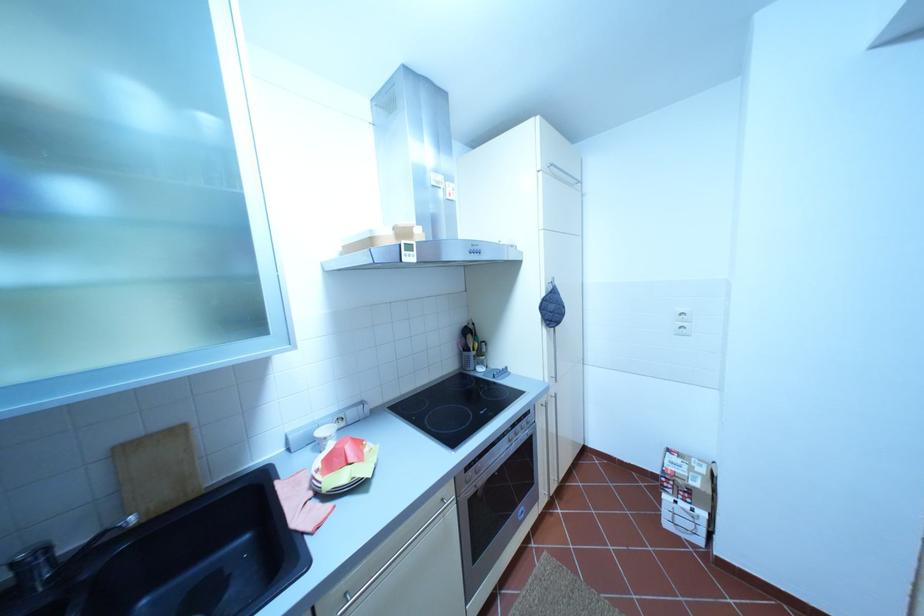
What are the coordinates of `sink faucet handle` in the screenshot? It's located at (37, 554).